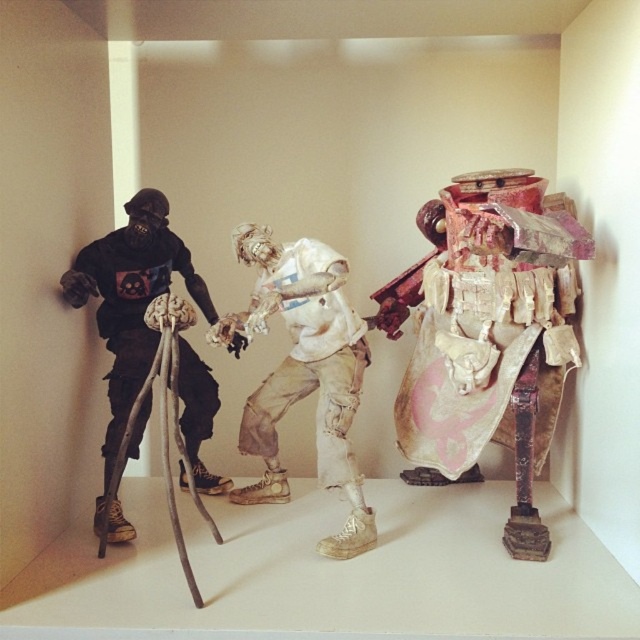
Question: Which point is farther from the camera taking this photo?

Choices:
 (A) (253, 250)
 (B) (560, 330)
 (C) (124, 324)

Answer: (A)

Question: Among these points, which one is nearest to the camera?

Choices:
 (A) (84, 273)
 (B) (486, 413)
 (C) (349, 380)

Answer: (B)

Question: Is distressed fabric shield at center bigger than matte black figure at left?

Choices:
 (A) yes
 (B) no

Answer: (A)

Question: Which point is farther to the camera?

Choices:
 (A) (349, 461)
 (B) (106, 256)

Answer: (B)

Question: Does distressed fabric shield at center have a greater width compared to matte black figure at left?

Choices:
 (A) yes
 (B) no

Answer: (A)

Question: Does distressed fabric shield at center have a larger size compared to matte black figure at left?

Choices:
 (A) yes
 (B) no

Answer: (A)